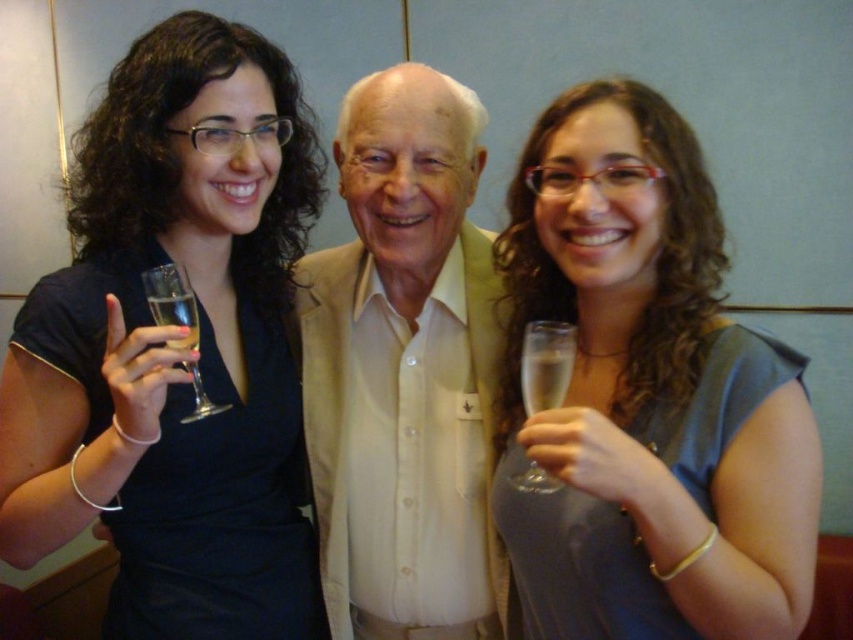
Image resolution: width=853 pixels, height=640 pixels. What do you see at coordinates (404, 369) in the screenshot? I see `light beige shirt at center` at bounding box center [404, 369].

Can you confirm if light beige shirt at center is shorter than clear glass wine glass at left?

No.

The width and height of the screenshot is (853, 640). What do you see at coordinates (404, 369) in the screenshot? I see `light beige shirt at center` at bounding box center [404, 369].

Find the location of a particular element. This screenshot has width=853, height=640. light beige shirt at center is located at coordinates (404, 369).

Does matte gray dress at center appear on the left side of light beige shirt at center?

Incorrect, matte gray dress at center is not on the left side of light beige shirt at center.

Who is more forward, (x=518, y=572) or (x=425, y=234)?

Point (x=518, y=572) is more forward.

What do you see at coordinates (646, 397) in the screenshot?
I see `matte gray dress at center` at bounding box center [646, 397].

You are a GUI agent. You are given a task and a screenshot of the screen. Output one action in this format:
    pyautogui.click(x=<x>, y=<y>)
    Task: Click on the matte gray dress at center
    The image size is (853, 640).
    Given the screenshot: What is the action you would take?
    pyautogui.click(x=646, y=397)

Is point (514, 177) closer to camera compared to point (189, 330)?

That is False.

Can you confirm if matte gray dress at center is positioned to the right of clear glass wine glass at left?

Yes, matte gray dress at center is to the right of clear glass wine glass at left.

The width and height of the screenshot is (853, 640). Find the location of `matte gray dress at center`. matte gray dress at center is located at coordinates (646, 397).